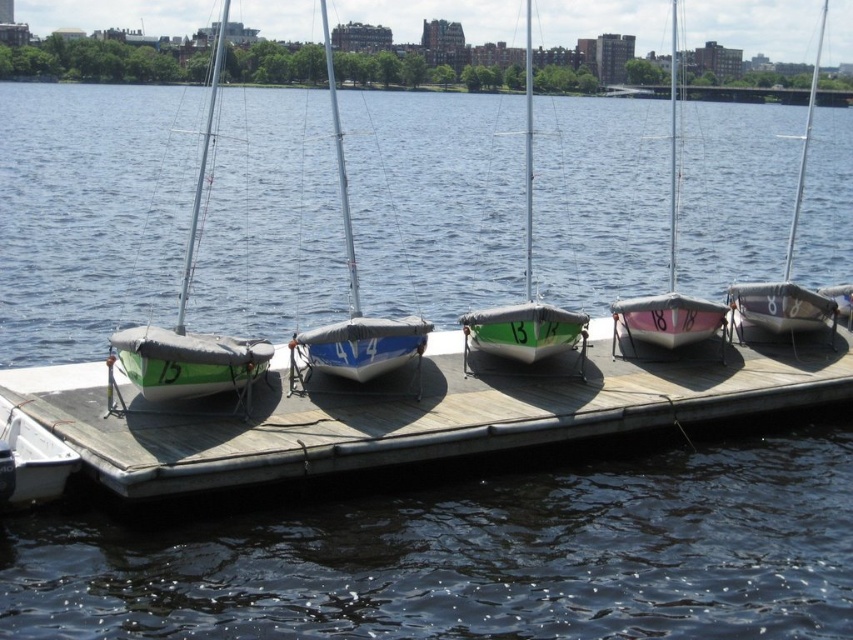
You are standing on the wooden pier and see the white matte sailboat at center and the green matte sailboat at center. Which boat is closer to you?

The white matte sailboat at center is closer to you because it is in front of the green matte sailboat at center.

You are a dock worker who needs to move a 40 feet long cargo container from the green matte sailboat at center to the metallic gray sailboat at right. Can you safely transport the container without it touching either boat?

The distance between the green matte sailboat at center and the metallic gray sailboat at right is 43.46 feet. Since the cargo container is 40 feet long, there is enough space to transport it without touching either boat.